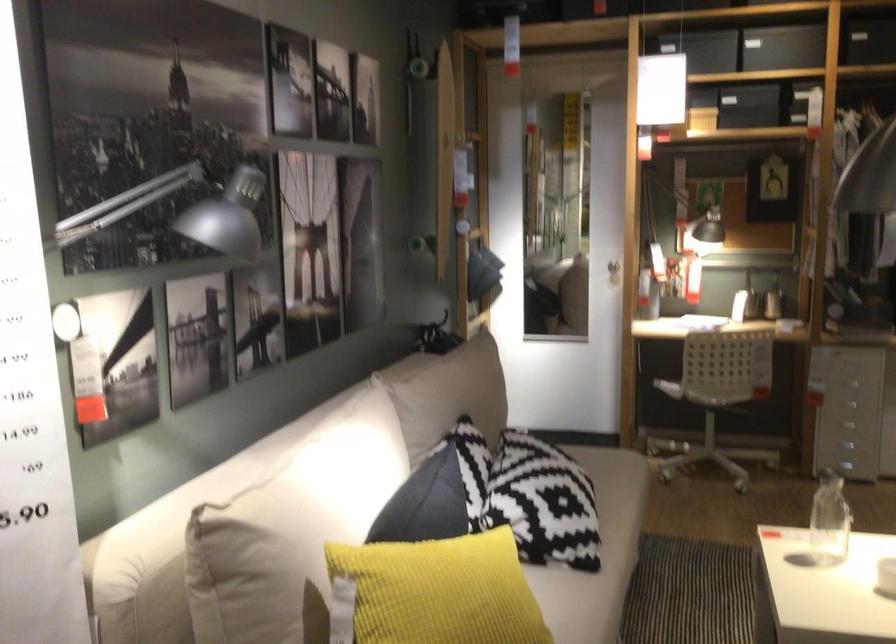
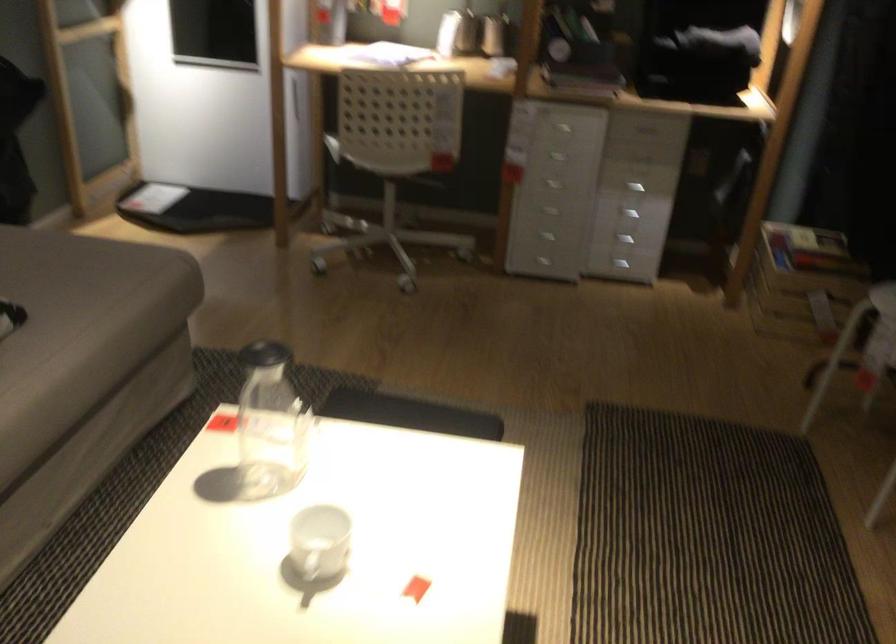
Locate, in the second image, the point that corresponds to pixel 730 377 in the first image.

(388, 158)